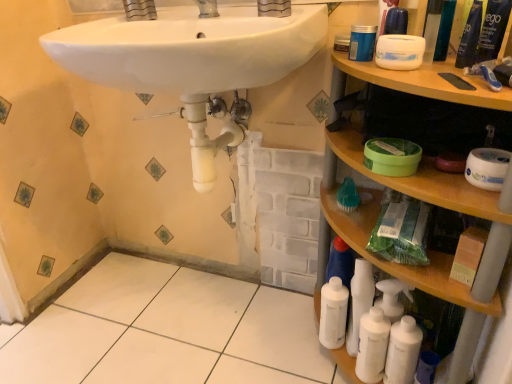
Question: Can you confirm if white plastic bottle at lower right is bigger than blue plastic container at upper right, acting as the 1th mouthwash starting from the left?

Choices:
 (A) no
 (B) yes

Answer: (B)

Question: Is the position of white plastic bottle at lower right less distant than that of blue plastic container at upper right, which appears as the 4th mouthwash when viewed from the top?

Choices:
 (A) no
 (B) yes

Answer: (A)

Question: From a real-world perspective, does white plastic bottle at lower right stand above blue plastic container at upper right, which ranks as the 5th mouthwash in right-to-left order?

Choices:
 (A) yes
 (B) no

Answer: (B)

Question: Is white plastic bottle at lower right behind blue plastic container at upper right, which appears as the 4th mouthwash when viewed from the top?

Choices:
 (A) yes
 (B) no

Answer: (A)

Question: Is white plastic bottle at lower right not close to blue plastic container at upper right, which ranks as the 5th mouthwash in right-to-left order?

Choices:
 (A) no
 (B) yes

Answer: (A)

Question: Considering the relative sizes of white plastic bottle at lower right and blue plastic container at upper right, which appears as the 4th mouthwash when viewed from the top, in the image provided, is white plastic bottle at lower right smaller than blue plastic container at upper right, which appears as the 4th mouthwash when viewed from the top,?

Choices:
 (A) no
 (B) yes

Answer: (A)

Question: Is white tile floor at lower left located outside green plastic mouthwash at upper right, which is counted as the 2th mouthwash, starting from the right?

Choices:
 (A) yes
 (B) no

Answer: (A)

Question: Is white tile floor at lower left taller than green plastic mouthwash at upper right, which is counted as the 2th mouthwash, starting from the right?

Choices:
 (A) no
 (B) yes

Answer: (A)

Question: Is white tile floor at lower left smaller than green plastic mouthwash at upper right, which is counted as the 2th mouthwash, starting from the right?

Choices:
 (A) no
 (B) yes

Answer: (A)

Question: Does white tile floor at lower left appear on the left side of green plastic mouthwash at upper right, which is counted as the 2th mouthwash, starting from the right?

Choices:
 (A) yes
 (B) no

Answer: (A)

Question: Is there a large distance between white tile floor at lower left and green plastic mouthwash at upper right, arranged as the first mouthwash when viewed from the top?

Choices:
 (A) no
 (B) yes

Answer: (A)

Question: Is the position of white tile floor at lower left more distant than that of green plastic mouthwash at upper right, the fourth mouthwash viewed from the left?

Choices:
 (A) yes
 (B) no

Answer: (B)

Question: From the image's perspective, does white matte toilet paper at right, marked as the 2th toilet paper in a left-to-right arrangement, appear higher than matte silver faucet at upper center?

Choices:
 (A) yes
 (B) no

Answer: (B)